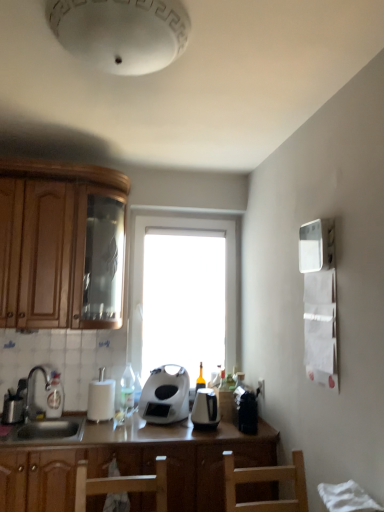
Image resolution: width=384 pixels, height=512 pixels. Identify the location of free space in front of black plastic kettle at center, which appears as the 1th kitchen appliance when viewed from the right. (209, 436).